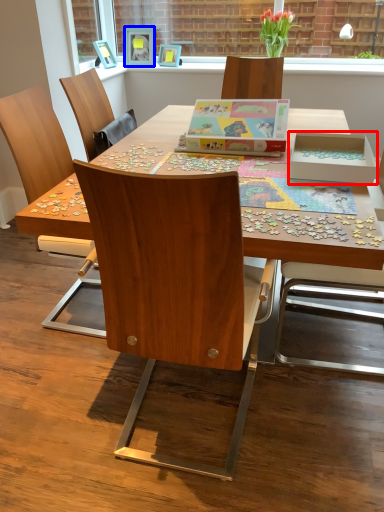
Question: Which of the following is the farthest to the observer, box (highlighted by a red box) or picture frame (highlighted by a blue box)?

Choices:
 (A) box
 (B) picture frame

Answer: (B)